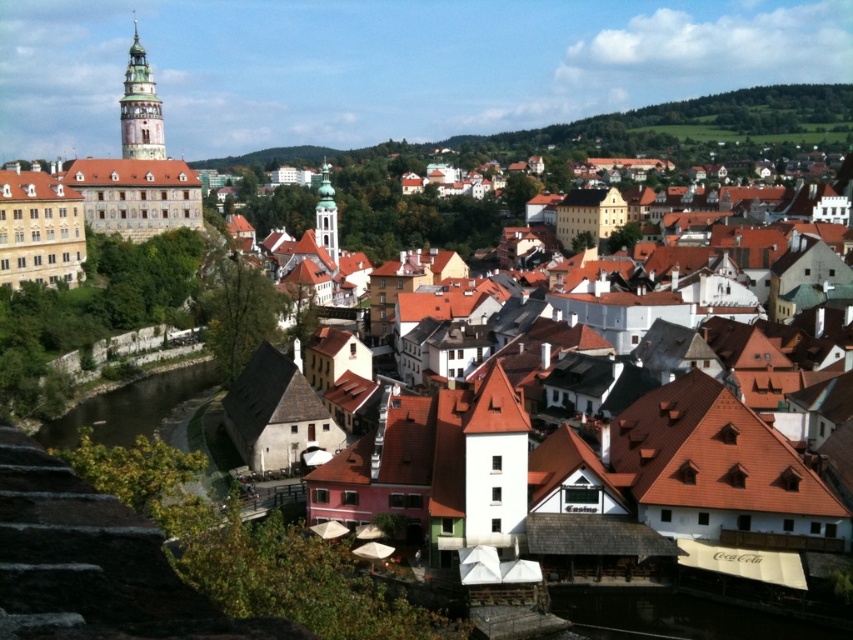
You are standing on a hill overlooking the town and want to take a photo of both the brown concrete river at lower left and the green glass tower at center. Which object will appear larger in your camera viewfinder?

The brown concrete river at lower left will appear larger in the camera viewfinder because it is closer to the viewer than the green glass tower at center.

You are an architect planning to build a new observation deck that must be elevated above both the brown tiled roofs at center and the brown concrete river at lower left. Which object requires the deck to be built higher to clear it?

The brown tiled roofs at center requires the deck to be built higher since it is much taller than the brown concrete river at lower left.